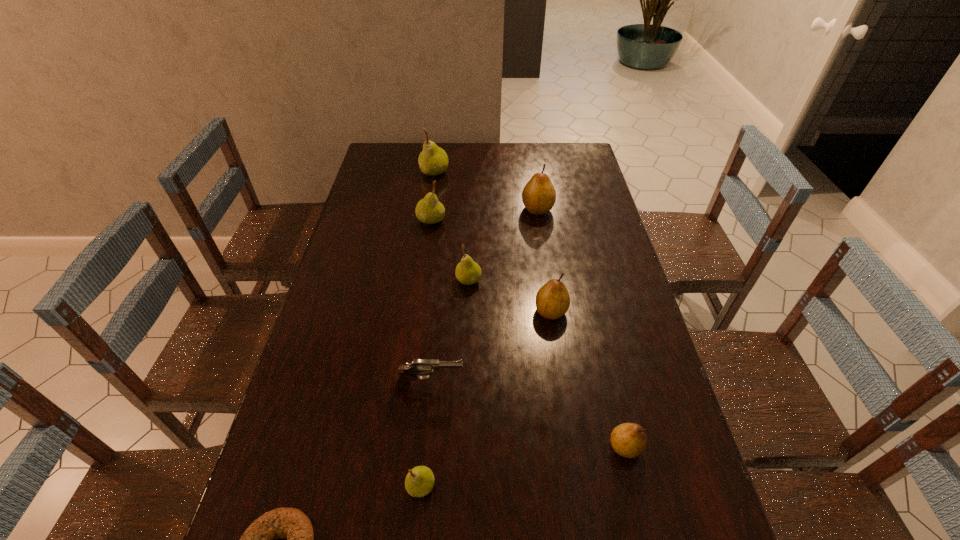
Image resolution: width=960 pixels, height=540 pixels. I want to click on green pear that stands as the fourth closest to the biggest brown pear, so click(x=419, y=482).

Choose which brown pear is the second nearest neighbor to the second nearest pear. Please provide its 2D coordinates. Your answer should be formatted as a tuple, i.e. [(x, y)], where the tuple contains the x and y coordinates of a point satisfying the conditions above.

[(539, 195)]

At what (x,y) coordinates should I click in order to perform the action: click on brown pear that is the closest to the nearest brown pear. Please return your answer as a coordinate pair (x, y). This screenshot has height=540, width=960. Looking at the image, I should click on (552, 300).

Image resolution: width=960 pixels, height=540 pixels. I want to click on vacant area in the image that satisfies the following two spatial constraints: 1. at the barrel of the seventh farthest object; 2. on the right side of the gray pistol, so click(423, 447).